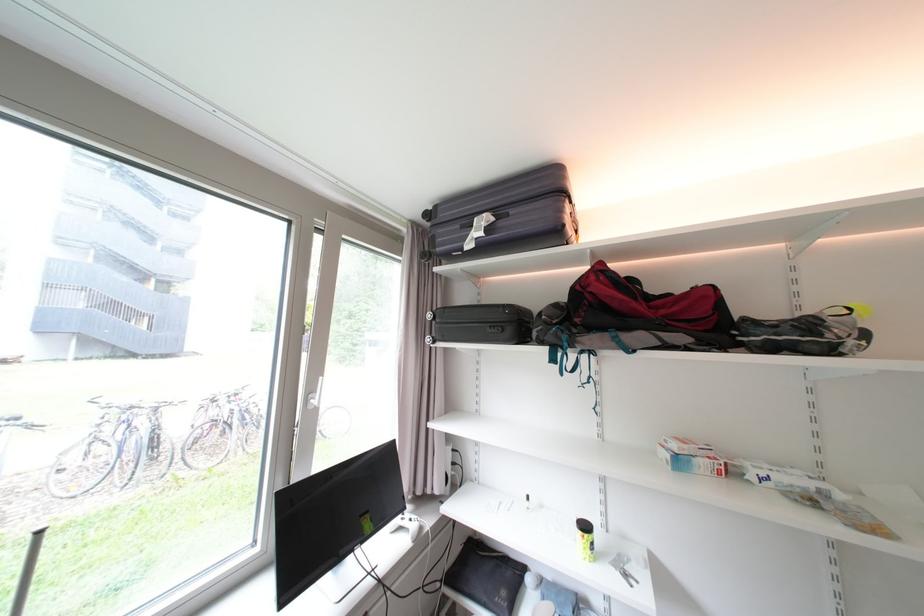
Find the location of a particular element. This screenshot has height=616, width=924. duffel bag strap is located at coordinates (650, 309).